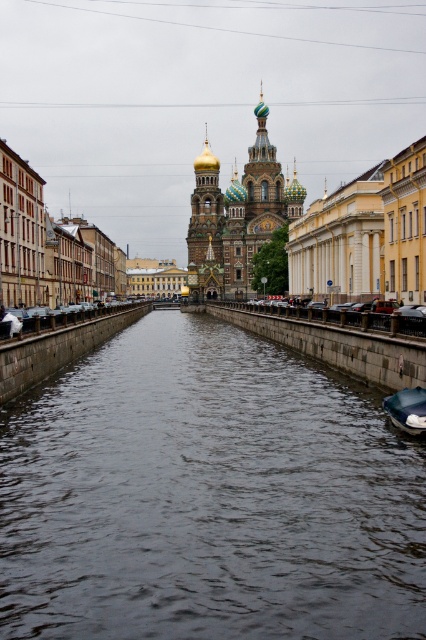
You are standing at the point with coordinates 0.5, 0.5 in the image. Which direction should you move to reach the dark gray concrete river at center?

You should move towards the coordinates (207, 497) to reach the dark gray concrete river at center.

You are a tourist standing on the canal side and want to take a photo of the dark gray concrete river at center and the dark blue fabric boat at lower right. Which object should you focus on first if you want to capture both in a single frame without moving the camera?

The dark gray concrete river at center has a larger size compared to the dark blue fabric boat at lower right, so you should focus on the dark gray concrete river at center first to ensure it fills the frame adequately before adjusting for the smaller boat.